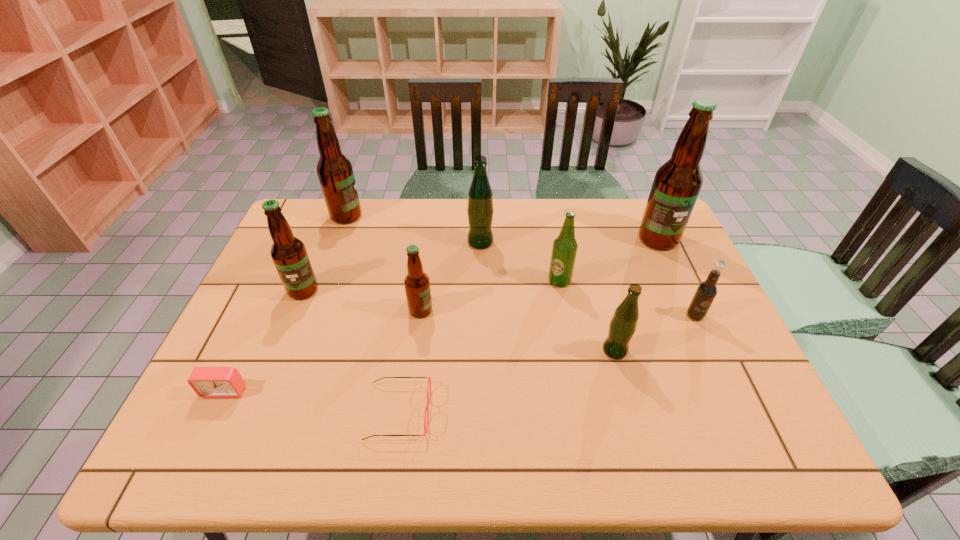
You are a GUI agent. You are given a task and a screenshot of the screen. Output one action in this format:
    pyautogui.click(x=<x>, y=<y>)
    Task: Click on the tallest beer bottle
    
    Given the screenshot: What is the action you would take?
    pyautogui.click(x=677, y=183)

This screenshot has height=540, width=960. Find the location of `the third nearest brown beer bottle`. the third nearest brown beer bottle is located at coordinates (677, 183).

Locate an element on the screen. the farthest object is located at coordinates (334, 170).

The width and height of the screenshot is (960, 540). What are the coordinates of `the farthest beer bottle` in the screenshot? It's located at (334, 170).

I want to click on the biggest green beer bottle, so click(480, 210).

The height and width of the screenshot is (540, 960). Identify the location of the leftmost green beer bottle. 480,210.

Locate an element on the screen. This screenshot has width=960, height=540. the second nearest brown beer bottle is located at coordinates (289, 255).

Find the location of a particular element. the fourth object from right to left is located at coordinates (564, 250).

Locate an element on the screen. Image resolution: width=960 pixels, height=540 pixels. the second green beer bottle from left to right is located at coordinates (564, 250).

What are the coordinates of `the sixth farthest beer bottle` in the screenshot? It's located at click(417, 284).